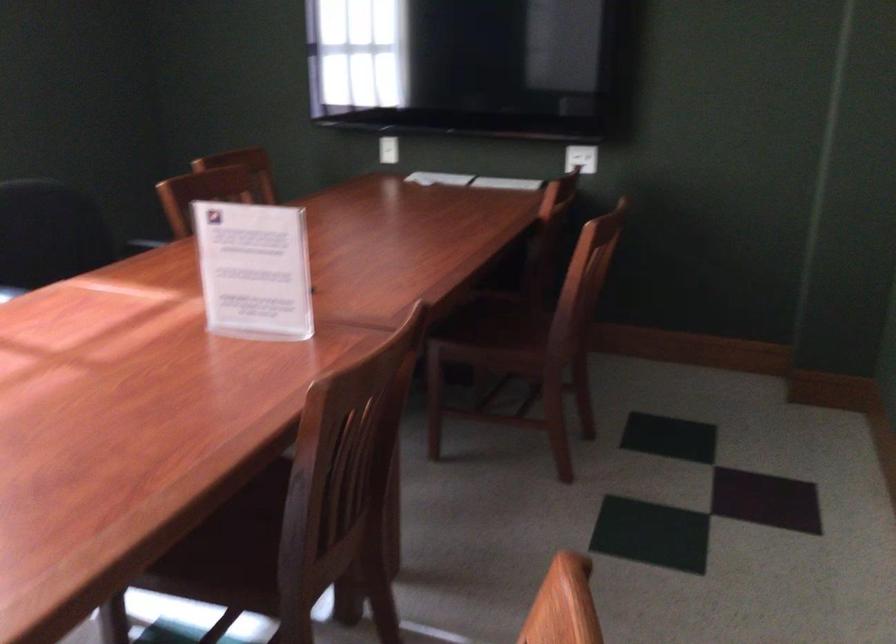
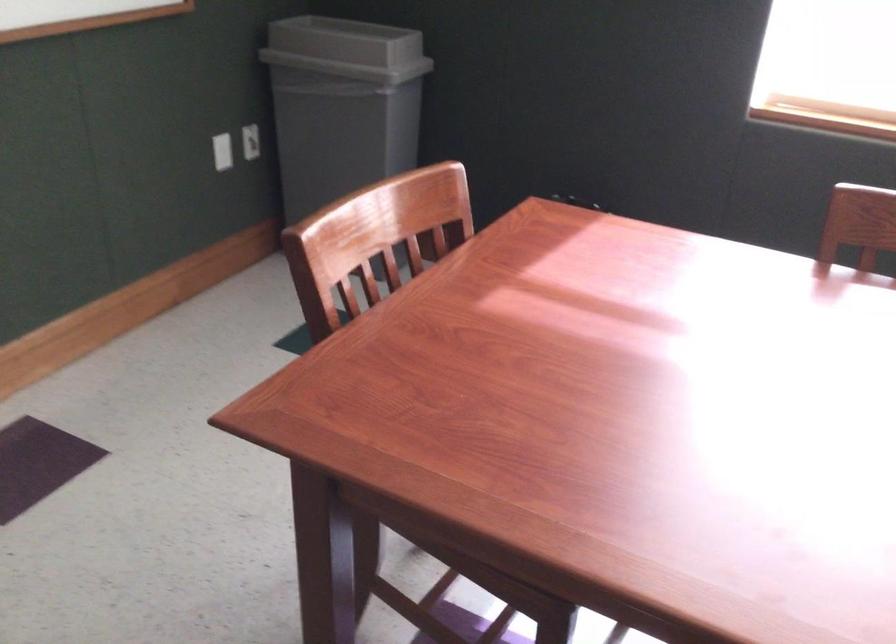
The images are taken continuously from a first-person perspective. In which direction is your viewpoint rotating?

The camera's rotation is toward left-down.